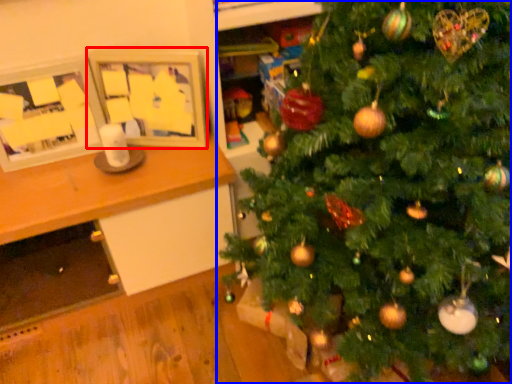
Question: Which of the following is the farthest to the observer, picture frame (highlighted by a red box) or christmas tree (highlighted by a blue box)?

Choices:
 (A) picture frame
 (B) christmas tree

Answer: (A)